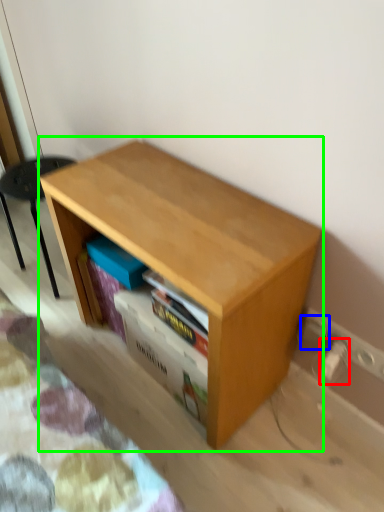
Question: Considering the real-world distances, which object is closest to electric outlet (highlighted by a red box)? electric outlet (highlighted by a blue box) or table (highlighted by a green box).

Choices:
 (A) electric outlet
 (B) table

Answer: (A)